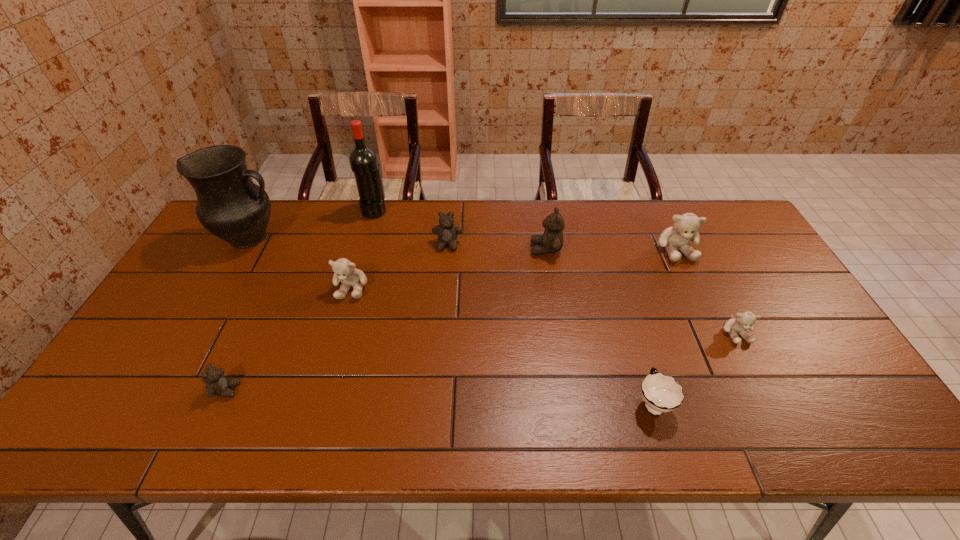
Locate an element on the screen. This screenshot has height=540, width=960. pitcher located at the far edge is located at coordinates (230, 205).

This screenshot has width=960, height=540. In order to click on object at the near edge in this screenshot , I will do `click(661, 393)`.

What are the coordinates of `object that is at the left edge` in the screenshot? It's located at (230, 205).

Find the location of a particular element. This screenshot has height=540, width=960. object that is at the far left corner is located at coordinates (230, 205).

This screenshot has height=540, width=960. I want to click on vacant region at the far edge of the desktop, so click(x=602, y=225).

You are a GUI agent. You are given a task and a screenshot of the screen. Output one action in this format:
    pyautogui.click(x=<x>, y=<y>)
    Task: Click on the free space at the near edge
    This screenshot has height=540, width=960.
    Given the screenshot: What is the action you would take?
    pyautogui.click(x=191, y=415)

In the image, there is a desktop. Identify the location of vacant area at the left edge. This screenshot has height=540, width=960. (218, 293).

Where is `free space at the right edge of the desktop`? free space at the right edge of the desktop is located at coordinates (786, 304).

In the image, there is a desktop. Find the location of `vacant space at the far left corner`. vacant space at the far left corner is located at coordinates (271, 209).

Locate an element on the screen. This screenshot has height=540, width=960. free space at the far right corner of the desktop is located at coordinates tap(736, 227).